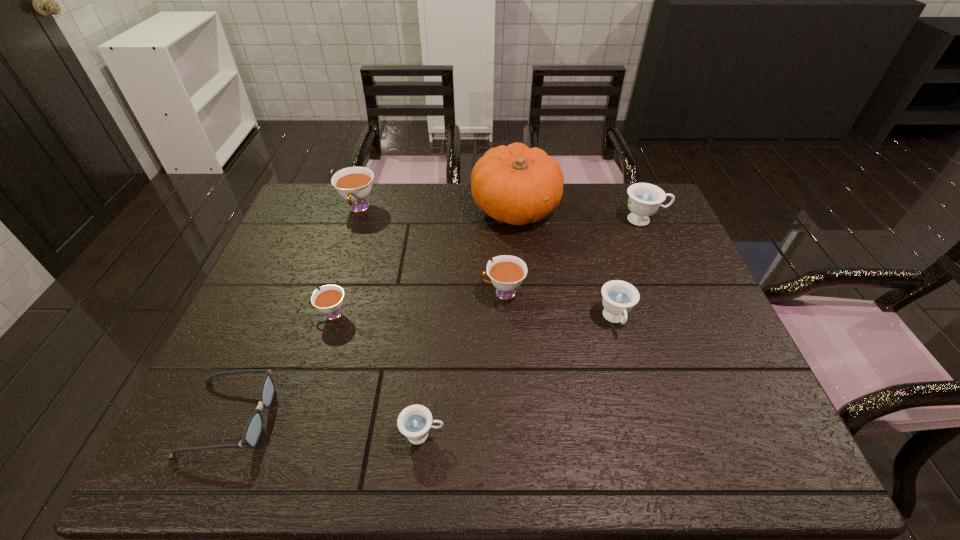
Identify which white teacup is located as the nearest to the farthest white teacup. Please provide its 2D coordinates. Your answer should be formatted as a tuple, i.e. [(x, y)], where the tuple contains the x and y coordinates of a point satisfying the conditions above.

[(329, 300)]

Image resolution: width=960 pixels, height=540 pixels. In order to click on the third closest white teacup to the orange pumpkin in this screenshot , I will do `click(329, 300)`.

Select which blue teacup is the second closest to the fourth teacup from left to right. Please provide its 2D coordinates. Your answer should be formatted as a tuple, i.e. [(x, y)], where the tuple contains the x and y coordinates of a point satisfying the conditions above.

[(414, 422)]

The height and width of the screenshot is (540, 960). Identify the location of blue teacup that can be found as the third closest to the pumpkin. (414, 422).

Where is `free space that satisfies the following two spatial constraints: 1. on the side of the pumpkin with the handle; 2. on the left side of the biggest white teacup`? free space that satisfies the following two spatial constraints: 1. on the side of the pumpkin with the handle; 2. on the left side of the biggest white teacup is located at coordinates (359, 208).